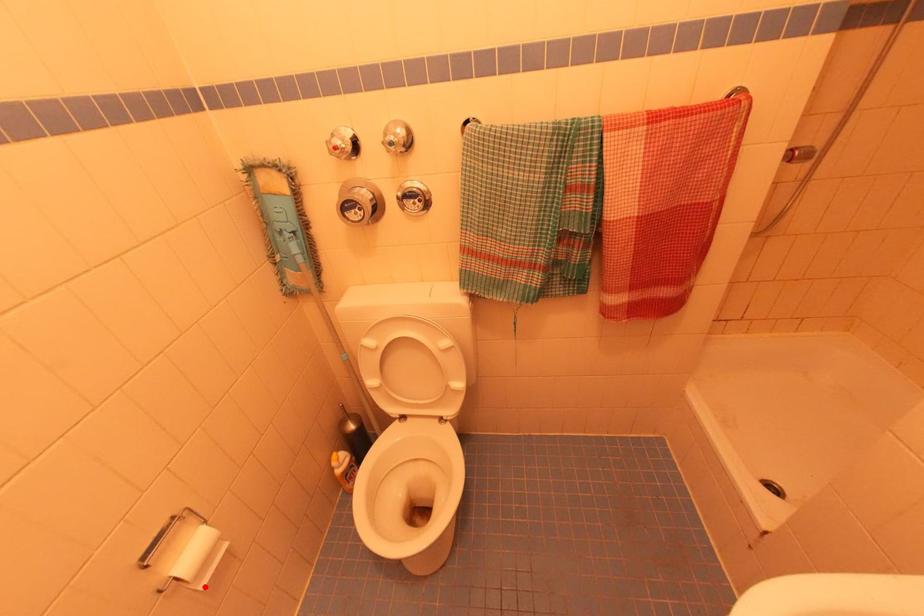
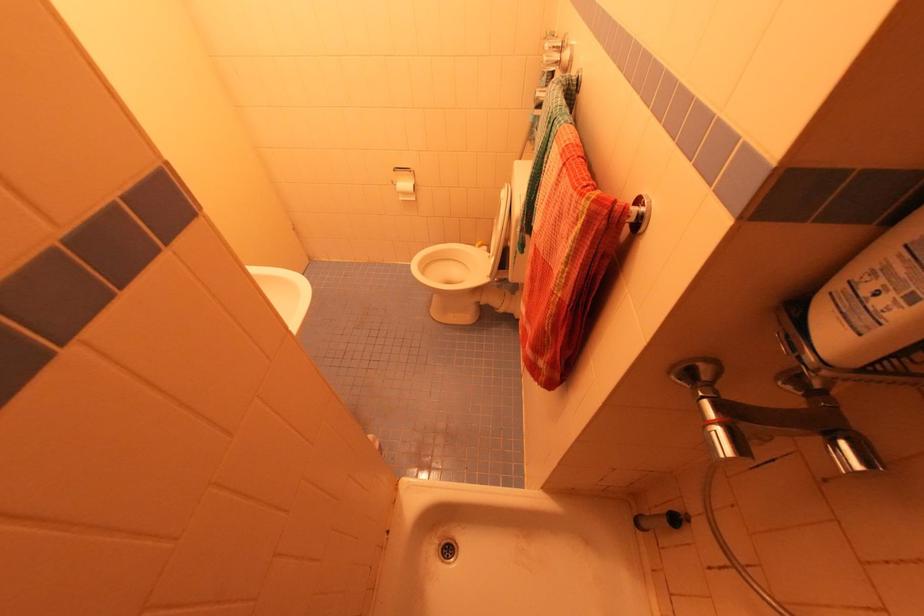
Question: I am providing you with two images of the same scene from different viewpoints. A red point is shown in image1. For the corresponding object point in image2, is it positioned nearer or farther from the camera?

Choices:
 (A) Nearer
 (B) Farther

Answer: (A)